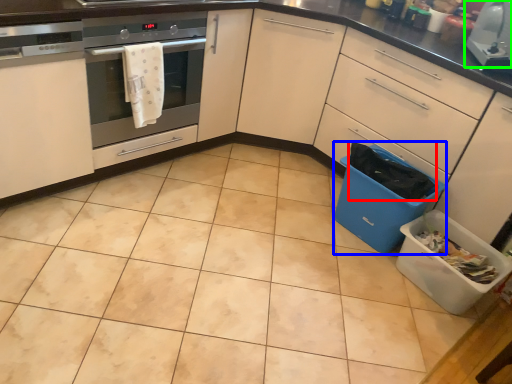
Question: Which object is the closest to the material (highlighted by a red box)? Choose among these: recycling bin (highlighted by a blue box) or kitchen appliance (highlighted by a green box).

Choices:
 (A) recycling bin
 (B) kitchen appliance

Answer: (A)